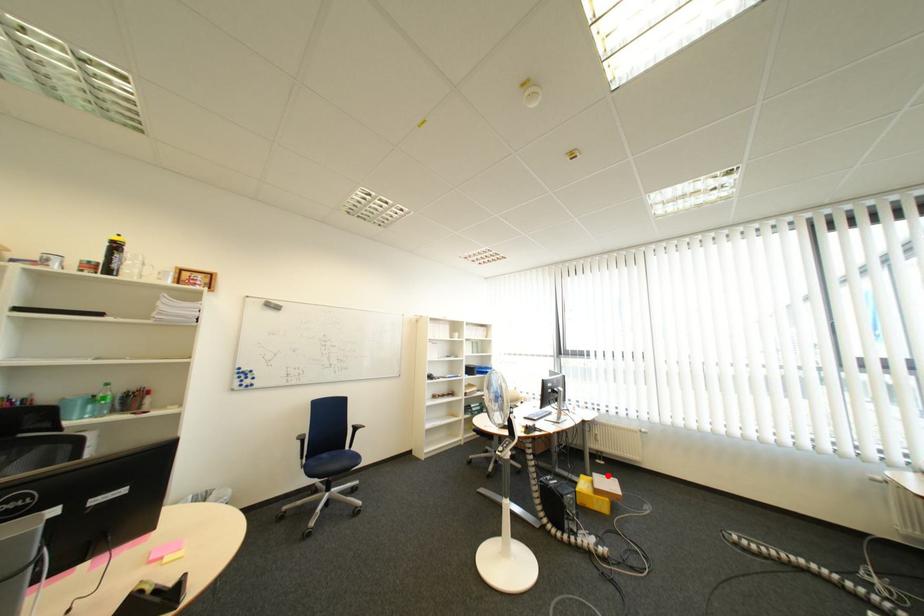
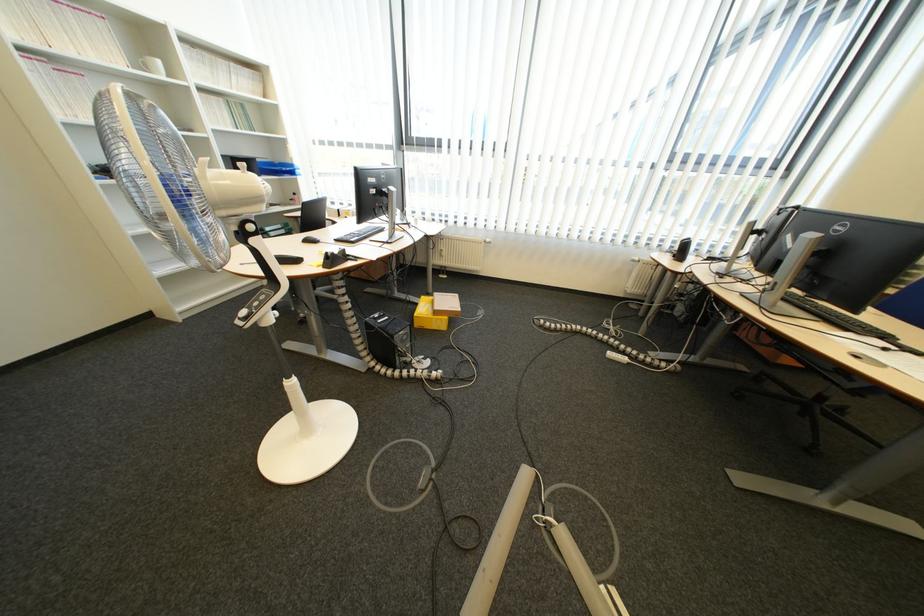
In the second image, find the point that corresponds to the highlighted location in the first image.

(448, 294)